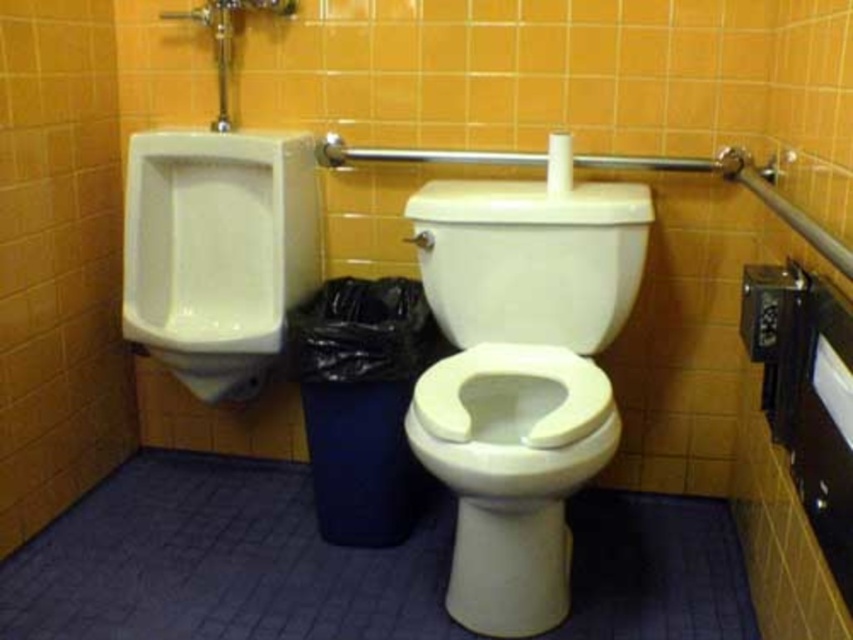
Is white glossy toilet bowl at center to the left of white glossy toilet lid at center from the viewer's perspective?

Yes, white glossy toilet bowl at center is to the left of white glossy toilet lid at center.

Describe the element at coordinates (520, 376) in the screenshot. This screenshot has height=640, width=853. I see `white glossy toilet bowl at center` at that location.

Image resolution: width=853 pixels, height=640 pixels. I want to click on white glossy toilet bowl at center, so click(520, 376).

Is white glossy toilet bowl at center to the right of white glossy urinal at left from the viewer's perspective?

Yes, white glossy toilet bowl at center is to the right of white glossy urinal at left.

The width and height of the screenshot is (853, 640). I want to click on white glossy toilet bowl at center, so click(x=520, y=376).

Who is more forward, (585, 456) or (198, 305)?

Positioned in front is point (585, 456).

You are a GUI agent. You are given a task and a screenshot of the screen. Output one action in this format:
    pyautogui.click(x=<x>, y=<y>)
    Task: Click on the white glossy toilet bowl at center
    Image resolution: width=853 pixels, height=640 pixels.
    Given the screenshot: What is the action you would take?
    pyautogui.click(x=520, y=376)

How distant is white glossy urinal at left from white glossy toilet lid at center?

23.23 inches

Who is higher up, white glossy urinal at left or white glossy toilet lid at center?

white glossy toilet lid at center is higher up.

Is point (183, 214) positioned in front of point (618, 212)?

No.

The width and height of the screenshot is (853, 640). What are the coordinates of `white glossy urinal at left` in the screenshot? It's located at (218, 252).